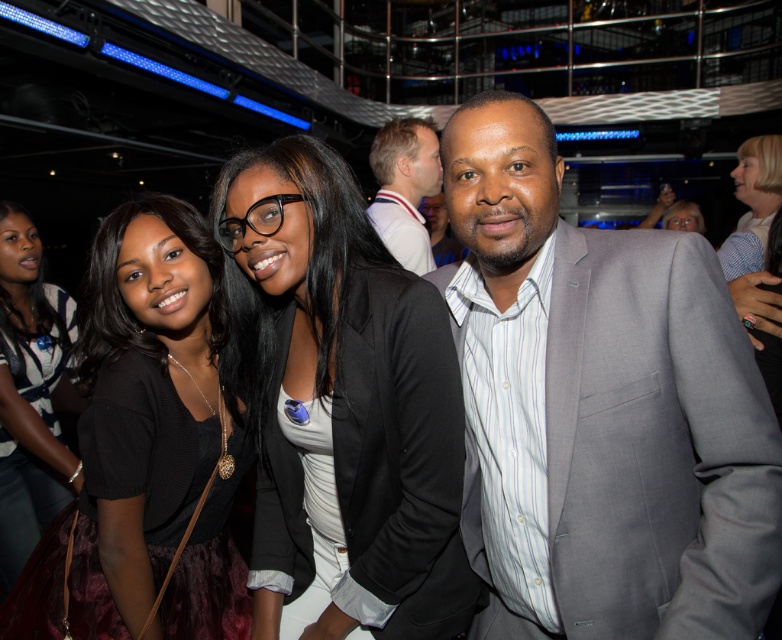
Question: Does black matte blazer at center appear over black matte dress at left?

Choices:
 (A) no
 (B) yes

Answer: (B)

Question: Based on their relative distances, which object is farther from the blonde hair at center?

Choices:
 (A) matte black dress at lower left
 (B) white shirt at upper center
 (C) black matte blazer at center

Answer: (A)

Question: Estimate the real-world distances between objects in this image. Which object is closer to the matte black dress at lower left?

Choices:
 (A) black matte dress at left
 (B) black matte blazer at center
 (C) gray suit at right
 (D) white shirt at upper center

Answer: (A)

Question: Does gray suit at right have a greater width compared to black matte blazer at center?

Choices:
 (A) no
 (B) yes

Answer: (A)

Question: In this image, where is white shirt at upper center located relative to blonde hair at center?

Choices:
 (A) left
 (B) right

Answer: (A)

Question: Which of the following is the farthest from the observer?

Choices:
 (A) black matte dress at left
 (B) gray suit at right

Answer: (A)